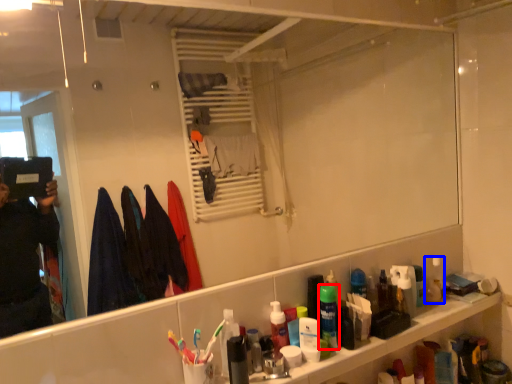
Question: Among these objects, which one is nearest to the camera, mouthwash (highlighted by a red box) or mouthwash (highlighted by a blue box)?

Choices:
 (A) mouthwash
 (B) mouthwash

Answer: (A)